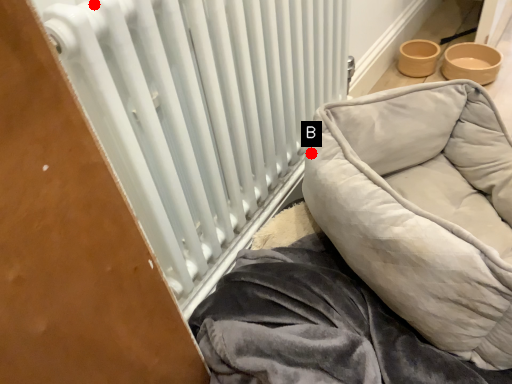
Question: Two points are circled on the image, labeled by A and B beside each circle. Which point is further to the camera?

Choices:
 (A) A is further
 (B) B is further

Answer: (B)